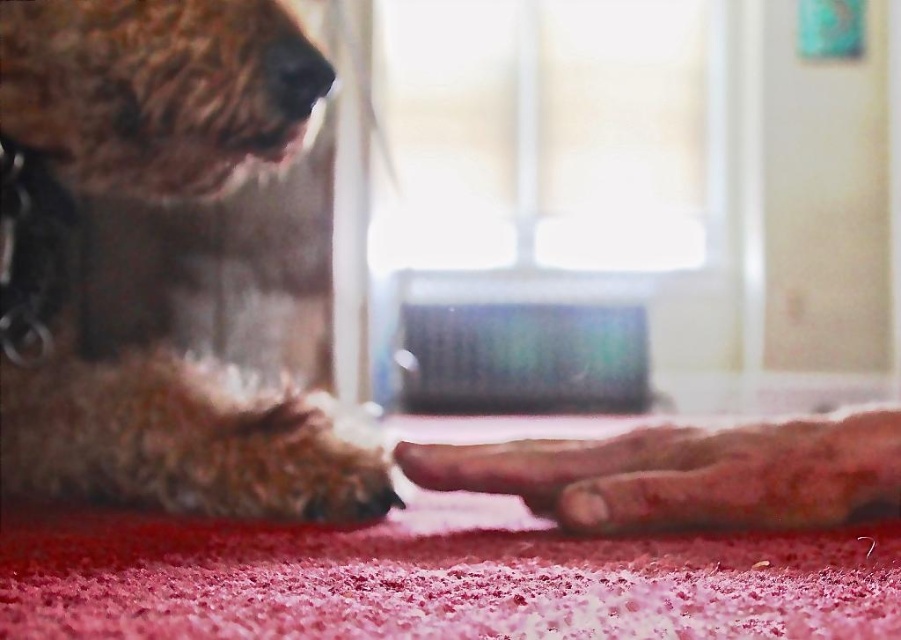
Is fuzzy brown dog at left above fuzzy fur paw at lower center?

Yes.

Between point (317, 486) and point (707, 509), which one is positioned in front?

Point (707, 509) is in front.

Describe the element at coordinates (142, 106) in the screenshot. I see `fuzzy brown dog at left` at that location.

In order to click on fuzzy brown dog at left in this screenshot , I will do `click(142, 106)`.